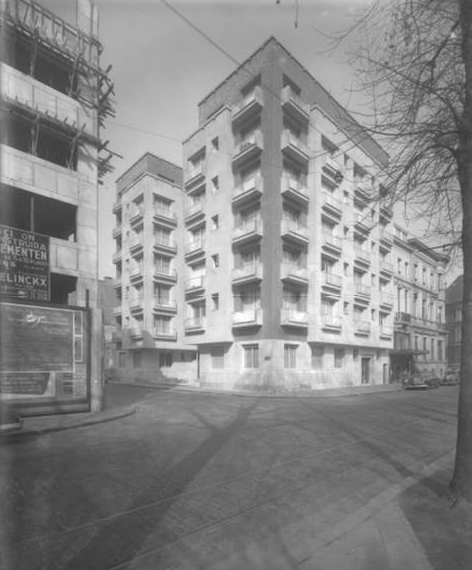
The width and height of the screenshot is (472, 570). Identify the location of cable. (233, 59).